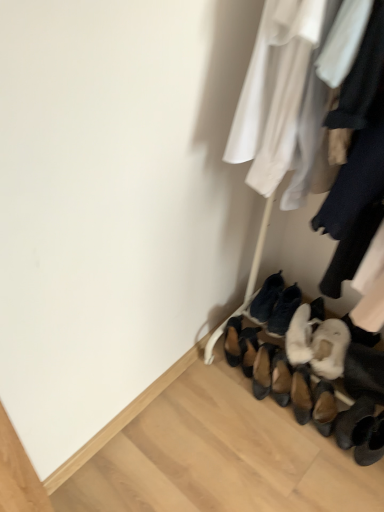
Question: Is brown suede shoes at lower center, arranged as the sixth footwear when viewed from the right, to the left or to the right of fuzzy white slippers at center, which is the 3th footwear in right-to-left order, in the image?

Choices:
 (A) left
 (B) right

Answer: (A)

Question: In terms of height, does brown suede shoes at lower center, arranged as the sixth footwear when viewed from the right, look taller or shorter compared to fuzzy white slippers at center, which is the 3th footwear in right-to-left order?

Choices:
 (A) short
 (B) tall

Answer: (B)

Question: Estimate the real-world distances between objects in this image. Which object is closer to the brown suede shoes at lower center, placed as the second footwear when sorted from left to right?

Choices:
 (A) white fur boot at lower right, the 2th footwear viewed from the right
 (B) white fluffy slippers at lower right, which is the 6th footwear from left to right
 (C) brown suede shoes at lower center, the first footwear viewed from the left
 (D) fuzzy white slippers at center, which is the 3th footwear in right-to-left order
 (E) black suede shoes at lower center, acting as the 4th footwear starting from the right

Answer: (C)

Question: Considering the real-world distances, which object is closest to the black suede shoes at lower center, acting as the 4th footwear starting from the right?

Choices:
 (A) white fluffy slippers at lower right, the 1th footwear from the right
 (B) brown suede shoes at lower center, the fifth footwear in the right-to-left sequence
 (C) brown suede shoes at lower center, arranged as the sixth footwear when viewed from the right
 (D) fuzzy white slippers at center, which is the 3th footwear in right-to-left order
 (E) white fur boot at lower right, the fifth footwear in the left-to-right sequence

Answer: (D)